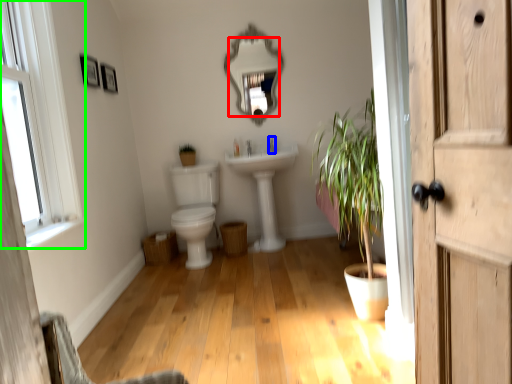
Question: Which is nearer to the mirror (highlighted by a red box)? faucet (highlighted by a blue box) or window (highlighted by a green box).

Choices:
 (A) faucet
 (B) window

Answer: (A)